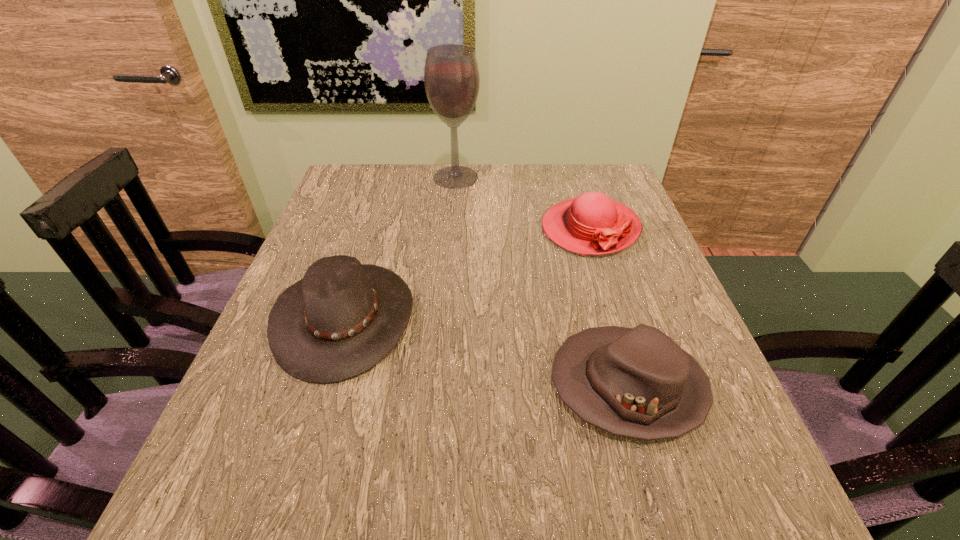
Find the location of `object that is at the far right corner`. object that is at the far right corner is located at coordinates (591, 224).

Image resolution: width=960 pixels, height=540 pixels. In order to click on vacant space at the far edge in this screenshot , I will do `click(523, 205)`.

Image resolution: width=960 pixels, height=540 pixels. Find the location of `vacant area at the left edge`. vacant area at the left edge is located at coordinates (274, 443).

This screenshot has width=960, height=540. In the image, there is a desktop. In order to click on vacant space at the right edge in this screenshot , I will do `click(622, 311)`.

Find the location of `free spot at the near left corner of the desktop`. free spot at the near left corner of the desktop is located at coordinates (220, 530).

You are a GUI agent. You are given a task and a screenshot of the screen. Output one action in this format:
    pyautogui.click(x=<x>, y=<y>)
    Task: Click on the vacant area at the near right corner of the desktop
    
    Given the screenshot: What is the action you would take?
    pyautogui.click(x=733, y=483)

I want to click on free spot between the tallest object and the second farthest object, so click(x=523, y=203).

Identify the location of free spot between the farthest hat and the leftmost hat. (468, 273).

I want to click on free area in between the third nearest object and the leftmost hat, so click(468, 273).

The image size is (960, 540). I want to click on free space between the leftmost hat and the tallest object, so click(400, 247).